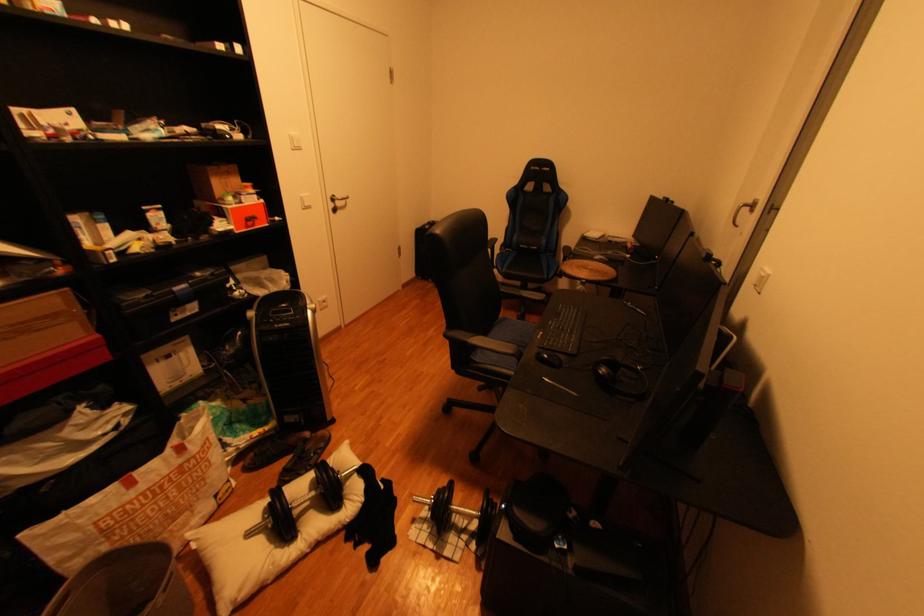
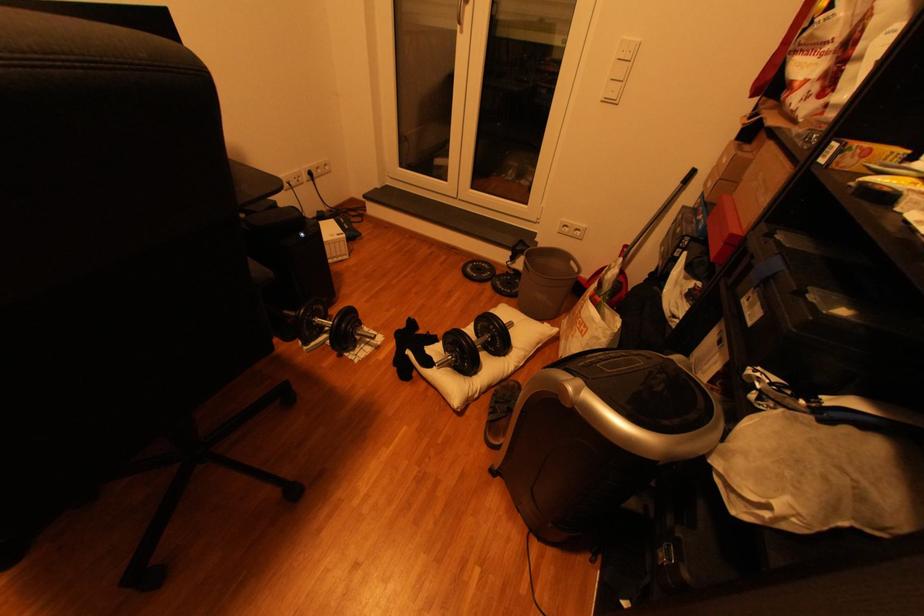
In the second image, find the point that corresponds to point (321, 459) in the first image.

(505, 402)